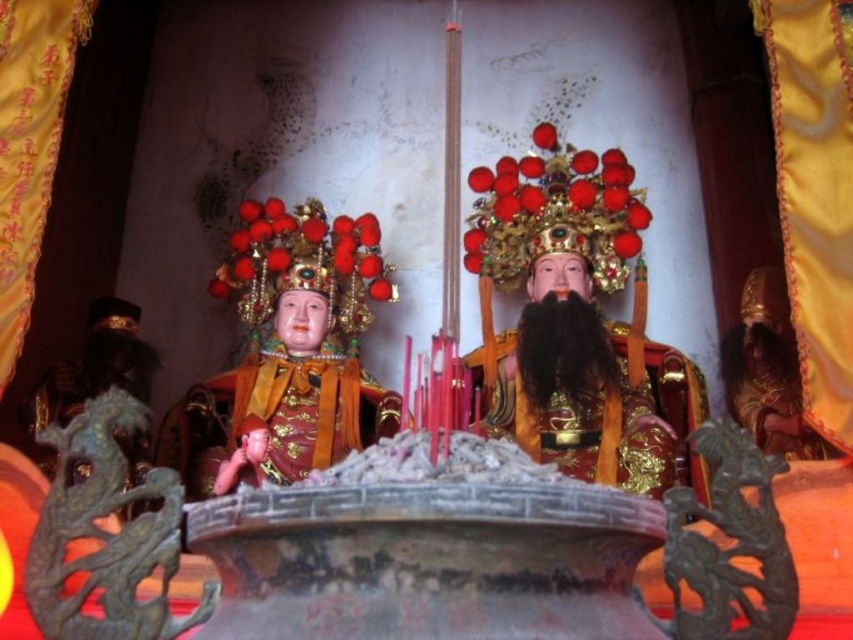
Consider the image. You are a temple visitor observing the gold textured statue at right and the smooth skin baby at lower left. Which object is located higher in the image?

The gold textured statue at right is positioned higher than the smooth skin baby at lower left.

You are an art student analyzing the composition of the temple scene. The image has a point marked at coordinates [767,371]. Which object in the scene does this point correspond to?

The point at coordinates [767,371] corresponds to the gold textured statue at right.

You are standing in a temple and see the glossy gold statue at center. If you want to light an incense stick at a safe distance of 1 meter away from the statue, can you do so?

The glossy gold statue at center and viewer are 67.45 meters apart from each other. Since the safe distance required is only 1 meter, you can easily light the incense stick at the required distance from the statue.